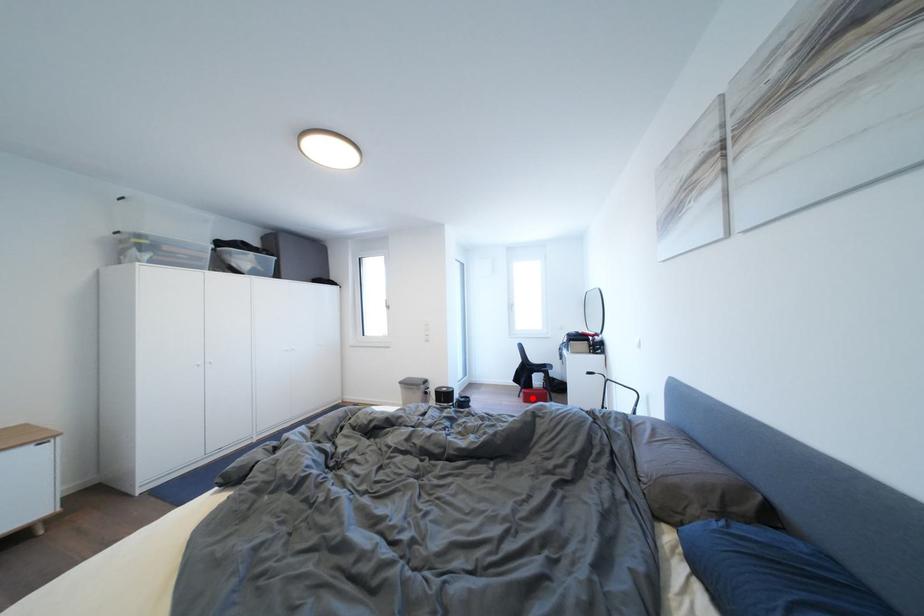
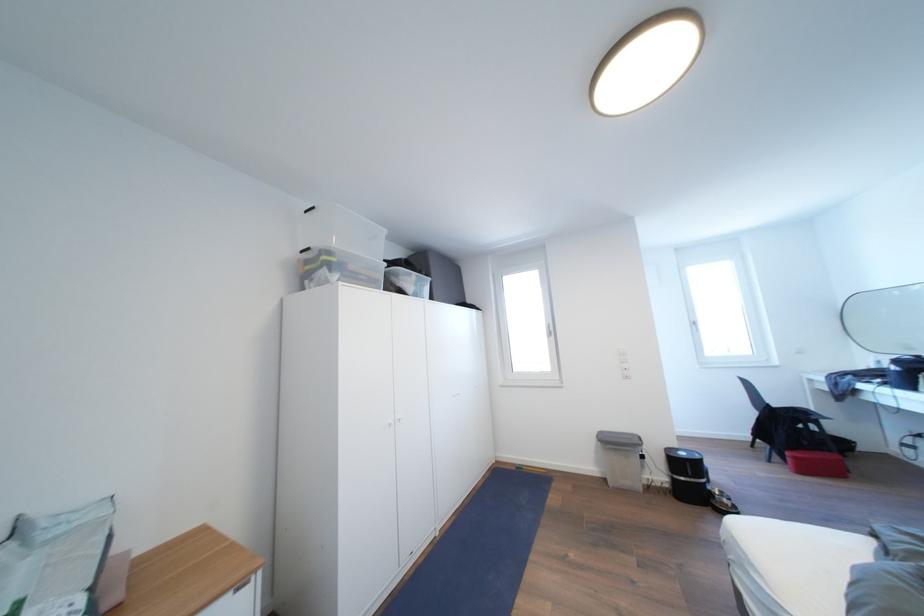
Question: A red point is marked in image1. In image2, is the corresponding 3D point closer to the camera or farther? Reply with the corresponding letter.

Choices:
 (A) The corresponding 3D point is closer.
 (B) The corresponding 3D point is farther.

Answer: (A)